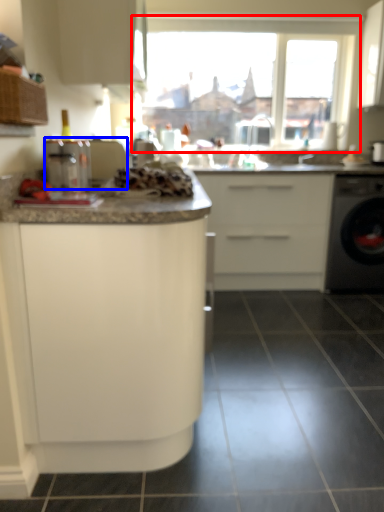
Question: Which point is further to the camera, window (highlighted by a red box) or appliance (highlighted by a blue box)?

Choices:
 (A) window
 (B) appliance

Answer: (A)